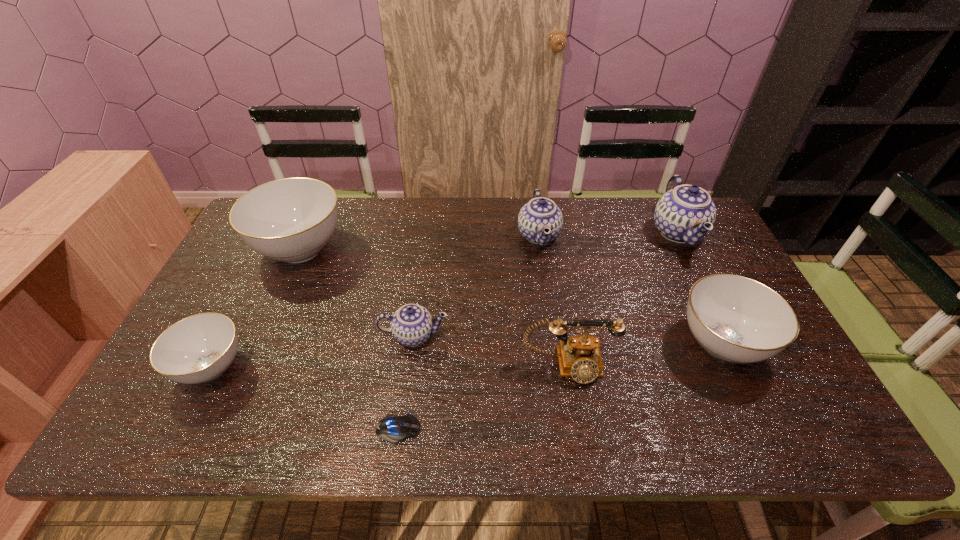
Identify the location of free point between the second blue chinaware from right to left and the nearest blue chinaware. (476, 286).

Find the location of a particular element. unoccupied position between the smallest blue chinaware and the smallest gray chinaware is located at coordinates (313, 351).

Where is `free space between the shortest object and the biggest gray chinaware`? free space between the shortest object and the biggest gray chinaware is located at coordinates (349, 339).

At what (x,y) coordinates should I click in order to perform the action: click on vacant space that is in between the rightmost gray chinaware and the telephone. Please return your answer as a coordinate pair (x, y). This screenshot has height=540, width=960. Looking at the image, I should click on (x=645, y=355).

The height and width of the screenshot is (540, 960). In order to click on empty location between the second biggest blue chinaware and the smallest gray chinaware in this screenshot , I will do `click(375, 301)`.

Where is `vacant space that is in between the nearest object and the nearest blue chinaware`? The height and width of the screenshot is (540, 960). vacant space that is in between the nearest object and the nearest blue chinaware is located at coordinates (406, 382).

In order to click on vacant area between the fourth chinaware from left to right and the nearest blue chinaware in this screenshot , I will do `click(476, 286)`.

You are a GUI agent. You are given a task and a screenshot of the screen. Output one action in this format:
    pyautogui.click(x=<x>, y=<y>)
    Task: Click on the third closest object relative to the smallest gray chinaware
    This screenshot has height=540, width=960.
    Given the screenshot: What is the action you would take?
    pyautogui.click(x=393, y=428)

This screenshot has height=540, width=960. I want to click on the sixth closest object to the second blue chinaware from right to left, so click(x=393, y=428).

The image size is (960, 540). I want to click on chinaware that is the third closest one to the nearest object, so click(291, 220).